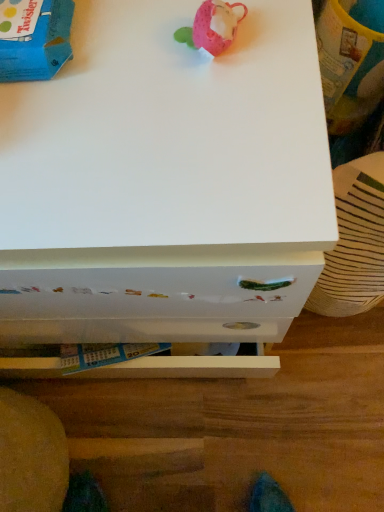
Locate an element on the screen. blue cardboard box at upper left, the 2th toy when ordered from right to left is located at coordinates (39, 45).

The image size is (384, 512). What do you see at coordinates (239, 426) in the screenshot?
I see `white glossy drawer at lower center` at bounding box center [239, 426].

Describe the element at coordinates (165, 182) in the screenshot. I see `white painted wood chest of drawers at center` at that location.

The width and height of the screenshot is (384, 512). I want to click on blue cardboard box at upper left, which is counted as the first toy, starting from the left, so (x=39, y=45).

Is white glossy drawer at lower center aimed at white painted wood chest of drawers at center?

No, white glossy drawer at lower center is not facing towards white painted wood chest of drawers at center.

From a real-world perspective, which is physically above, white glossy drawer at lower center or white painted wood chest of drawers at center?

white painted wood chest of drawers at center is physically above.

Does point (293, 395) lie behind point (60, 296)?

Yes.

Identify the location of the 2nd toy in front of the white glossy drawer at lower center, starting your count from the anchor. (213, 26).

From a real-world perspective, is white glossy drawer at lower center on top of pink fabric mouse at upper center, the 2th toy from the left?

No, from a real-world perspective, white glossy drawer at lower center is not on top of pink fabric mouse at upper center, the 2th toy from the left.

Considering the relative positions of white glossy drawer at lower center and pink fabric mouse at upper center, the 2th toy from the left, in the image provided, is white glossy drawer at lower center to the right of pink fabric mouse at upper center, the 2th toy from the left, from the viewer's perspective?

No, white glossy drawer at lower center is not to the right of pink fabric mouse at upper center, the 2th toy from the left.

Which of these two, white glossy drawer at lower center or pink fabric mouse at upper center, which is counted as the 1th toy, starting from the right, is thinner?

With smaller width is pink fabric mouse at upper center, which is counted as the 1th toy, starting from the right.

What's the angular difference between pink fabric mouse at upper center, the 2th toy from the left, and white painted wood chest of drawers at center's facing directions?

pink fabric mouse at upper center, the 2th toy from the left, and white painted wood chest of drawers at center are facing 2.56 degrees away from each other.

Is pink fabric mouse at upper center, which is counted as the 1th toy, starting from the right, far from white painted wood chest of drawers at center?

No, pink fabric mouse at upper center, which is counted as the 1th toy, starting from the right, is not far from white painted wood chest of drawers at center.

Can you confirm if pink fabric mouse at upper center, which is counted as the 1th toy, starting from the right, is shorter than white painted wood chest of drawers at center?

Yes.

Is pink fabric mouse at upper center, the 2th toy from the left, positioned beyond the bounds of white painted wood chest of drawers at center?

pink fabric mouse at upper center, the 2th toy from the left, is positioned outside white painted wood chest of drawers at center.

Considering the relative sizes of white painted wood chest of drawers at center and pink fabric mouse at upper center, which is counted as the 1th toy, starting from the right, in the image provided, is white painted wood chest of drawers at center bigger than pink fabric mouse at upper center, which is counted as the 1th toy, starting from the right,?

Yes, white painted wood chest of drawers at center is bigger than pink fabric mouse at upper center, which is counted as the 1th toy, starting from the right.

Considering the sizes of white painted wood chest of drawers at center and pink fabric mouse at upper center, which is counted as the 1th toy, starting from the right, in the image, is white painted wood chest of drawers at center taller or shorter than pink fabric mouse at upper center, which is counted as the 1th toy, starting from the right,?

In the image, white painted wood chest of drawers at center appears to be taller than pink fabric mouse at upper center, which is counted as the 1th toy, starting from the right.

From the image's perspective, is white painted wood chest of drawers at center located above or below pink fabric mouse at upper center, the 2th toy from the left?

Clearly, from the image's perspective, white painted wood chest of drawers at center is below pink fabric mouse at upper center, the 2th toy from the left.

From the image's perspective, is blue cardboard box at upper left, the 2th toy when ordered from right to left, above or below white glossy drawer at lower center?

blue cardboard box at upper left, the 2th toy when ordered from right to left, is above white glossy drawer at lower center.

Is blue cardboard box at upper left, which is counted as the first toy, starting from the left, turned away from white glossy drawer at lower center?

No, blue cardboard box at upper left, which is counted as the first toy, starting from the left, is not facing the opposite direction of white glossy drawer at lower center.

The height and width of the screenshot is (512, 384). In order to click on the 1st toy above the white glossy drawer at lower center (from a real-world perspective) in this screenshot , I will do `click(39, 45)`.

Is blue cardboard box at upper left, which is counted as the first toy, starting from the left, wider or thinner than white glossy drawer at lower center?

In the image, blue cardboard box at upper left, which is counted as the first toy, starting from the left, appears to be more narrow than white glossy drawer at lower center.

Does point (55, 56) lie in front of point (219, 7)?

That is False.

From the image's perspective, is blue cardboard box at upper left, which is counted as the first toy, starting from the left, below pink fabric mouse at upper center, which is counted as the 1th toy, starting from the right?

Actually, blue cardboard box at upper left, which is counted as the first toy, starting from the left, appears above pink fabric mouse at upper center, which is counted as the 1th toy, starting from the right, in the image.

Is blue cardboard box at upper left, which is counted as the first toy, starting from the left, at the right side of pink fabric mouse at upper center, which is counted as the 1th toy, starting from the right?

No, blue cardboard box at upper left, which is counted as the first toy, starting from the left, is not to the right of pink fabric mouse at upper center, which is counted as the 1th toy, starting from the right.

Considering the relative sizes of blue cardboard box at upper left, which is counted as the first toy, starting from the left, and pink fabric mouse at upper center, the 2th toy from the left, in the image provided, is blue cardboard box at upper left, which is counted as the first toy, starting from the left, bigger than pink fabric mouse at upper center, the 2th toy from the left,?

Indeed, blue cardboard box at upper left, which is counted as the first toy, starting from the left, has a larger size compared to pink fabric mouse at upper center, the 2th toy from the left.

Does point (36, 79) come closer to viewer compared to point (70, 74)?

Yes, point (36, 79) is in front of point (70, 74).

From the image's perspective, which one is positioned lower, blue cardboard box at upper left, which is counted as the first toy, starting from the left, or white painted wood chest of drawers at center?

white painted wood chest of drawers at center is shown below in the image.

Is blue cardboard box at upper left, which is counted as the first toy, starting from the left, far from white painted wood chest of drawers at center?

Actually, blue cardboard box at upper left, which is counted as the first toy, starting from the left, and white painted wood chest of drawers at center are a little close together.

Where is `the chest of drawers located above the white glossy drawer at lower center (from a real-world perspective)`? The height and width of the screenshot is (512, 384). the chest of drawers located above the white glossy drawer at lower center (from a real-world perspective) is located at coordinates (165, 182).

At what (x,y) coordinates should I click in order to perform the action: click on table located on the left of pink fabric mouse at upper center, the 2th toy from the left. Please return your answer as a coordinate pair (x, y). Image resolution: width=384 pixels, height=512 pixels. Looking at the image, I should click on (239, 426).

When comparing their distances from white glossy drawer at lower center, does pink fabric mouse at upper center, which is counted as the 1th toy, starting from the right, or white painted wood chest of drawers at center seem further?

pink fabric mouse at upper center, which is counted as the 1th toy, starting from the right, lies further to white glossy drawer at lower center than the other object.

When comparing their distances from white painted wood chest of drawers at center, does white glossy drawer at lower center or blue cardboard box at upper left, the 2th toy when ordered from right to left, seem further?

The object further to white painted wood chest of drawers at center is white glossy drawer at lower center.

Which object lies nearer to the anchor point white glossy drawer at lower center, blue cardboard box at upper left, which is counted as the first toy, starting from the left, or pink fabric mouse at upper center, the 2th toy from the left?

pink fabric mouse at upper center, the 2th toy from the left.

When comparing their distances from blue cardboard box at upper left, the 2th toy when ordered from right to left, does white painted wood chest of drawers at center or white glossy drawer at lower center seem closer?

The object closer to blue cardboard box at upper left, the 2th toy when ordered from right to left, is white painted wood chest of drawers at center.

Looking at the image, which one is located further to blue cardboard box at upper left, which is counted as the first toy, starting from the left, pink fabric mouse at upper center, which is counted as the 1th toy, starting from the right, or white glossy drawer at lower center?

The object further to blue cardboard box at upper left, which is counted as the first toy, starting from the left, is white glossy drawer at lower center.

Based on their spatial positions, is white glossy drawer at lower center or white painted wood chest of drawers at center further from blue cardboard box at upper left, which is counted as the first toy, starting from the left?

Among the two, white glossy drawer at lower center is located further to blue cardboard box at upper left, which is counted as the first toy, starting from the left.

Which object lies nearer to the anchor point blue cardboard box at upper left, the 2th toy when ordered from right to left, white glossy drawer at lower center or pink fabric mouse at upper center, the 2th toy from the left?

Among the two, pink fabric mouse at upper center, the 2th toy from the left, is located nearer to blue cardboard box at upper left, the 2th toy when ordered from right to left.

Considering their positions, is pink fabric mouse at upper center, the 2th toy from the left, positioned closer to white painted wood chest of drawers at center than white glossy drawer at lower center?

pink fabric mouse at upper center, the 2th toy from the left, is closer to white painted wood chest of drawers at center.

The image size is (384, 512). What are the coordinates of `toy between white painted wood chest of drawers at center and pink fabric mouse at upper center, the 2th toy from the left, in the horizontal direction` in the screenshot? It's located at (39, 45).

Find the location of a particular element. This screenshot has height=512, width=384. toy between blue cardboard box at upper left, the 2th toy when ordered from right to left, and white glossy drawer at lower center vertically is located at coordinates (213, 26).